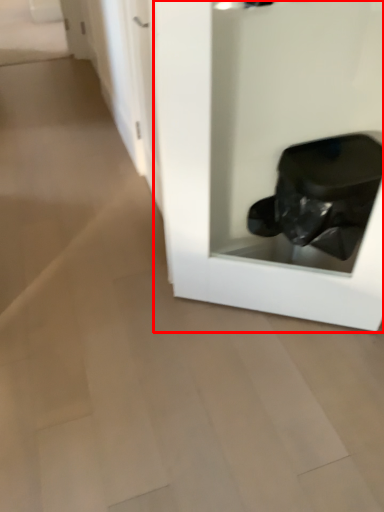
Question: From the image, what is the correct spatial relationship of glass door (annotated by the red box) in relation to door?

Choices:
 (A) right
 (B) left

Answer: (A)